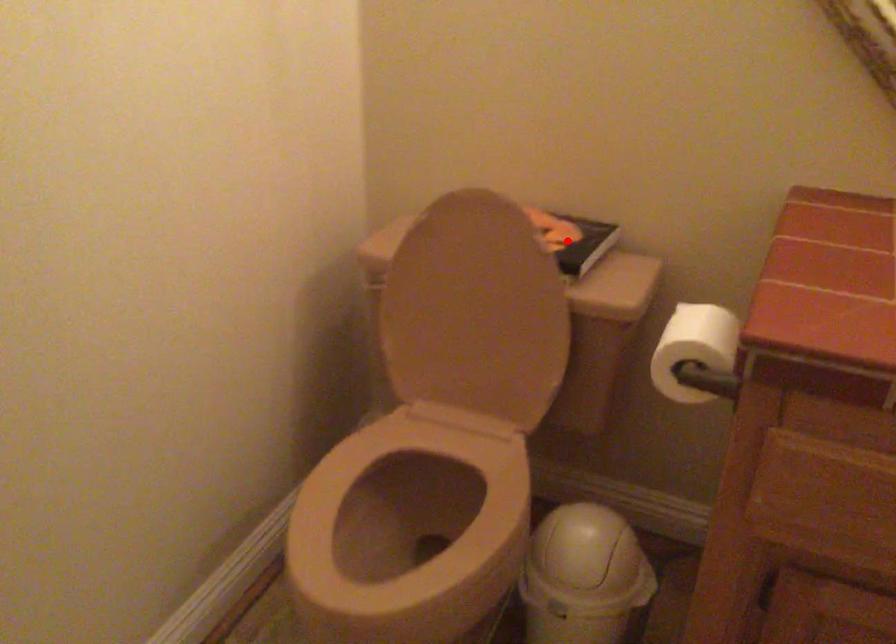
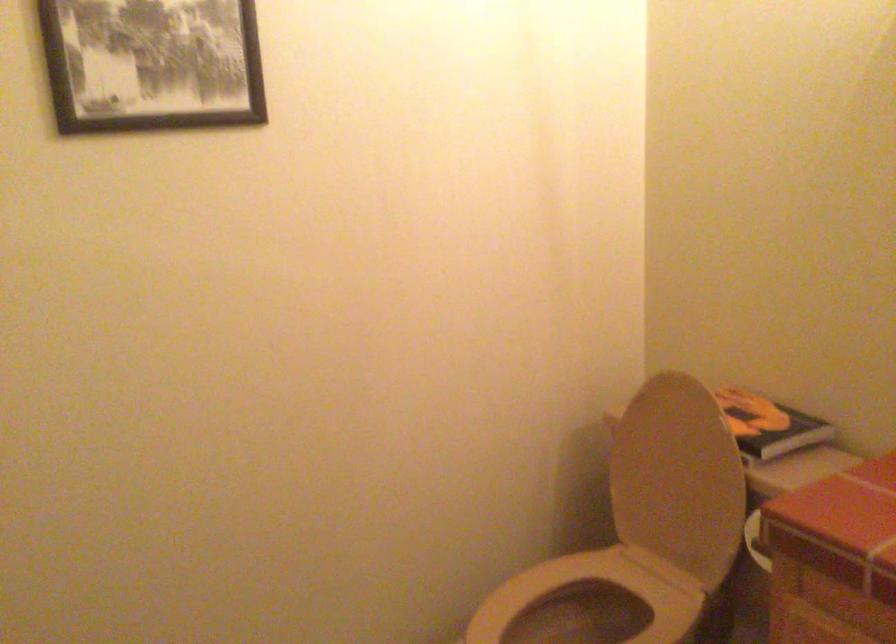
Question: I am providing you with two images of the same scene from different viewpoints. Image1 has a red point marked. In image2, the corresponding 3D location appears at what relative position? Reply with the corresponding letter.

Choices:
 (A) Closer
 (B) Farther

Answer: (B)